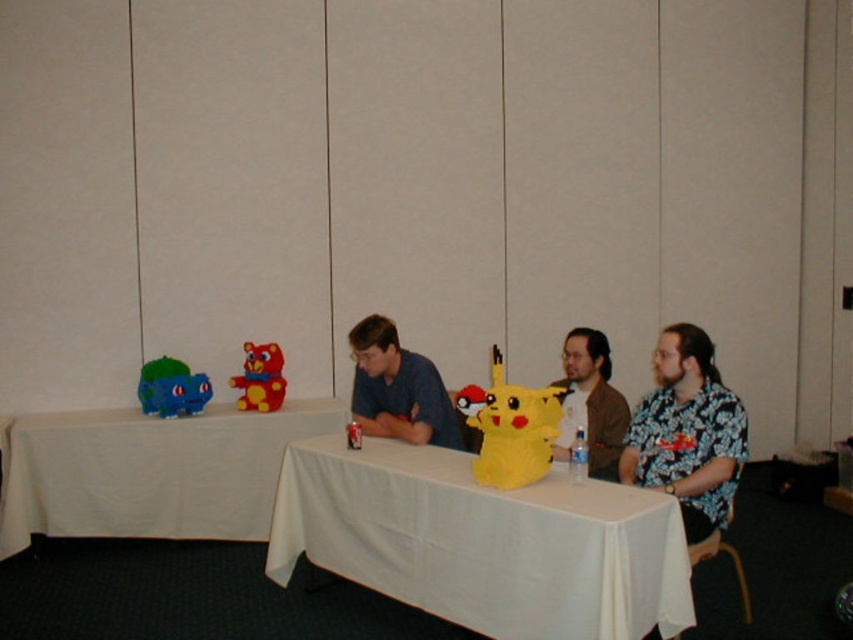
You are arranging a birthday party and need to place a centerpiece on the table. The white cloth table at center is already set. Where should you place the centerpiece relative to the white cloth at center?

The white cloth table at center is positioned on the right side of the white cloth at center, so the centerpiece should be placed on the right side of the white cloth at center to align with the table.

You are standing at the edge of the table looking towards the center. There is a point marked at coordinate (483, 541). Which direction should you move to reach the point from your current position?

The point at coordinate (483, 541) is located on the white cloth table at center, so you should move towards the center of the table to reach it.